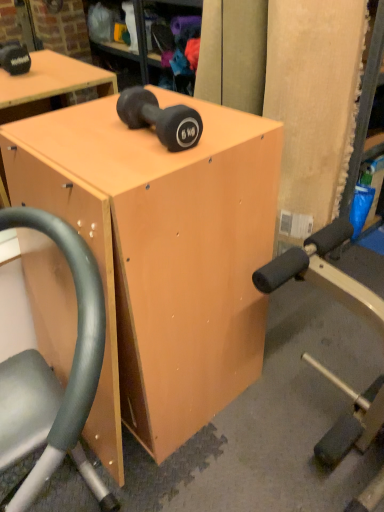
Where is `matte black dumbbell at center`? matte black dumbbell at center is located at coordinates (160, 118).

What do you see at coordinates (160, 118) in the screenshot?
I see `matte black dumbbell at center` at bounding box center [160, 118].

Where is `matte wood table at center`? The height and width of the screenshot is (512, 384). matte wood table at center is located at coordinates (161, 257).

Image resolution: width=384 pixels, height=512 pixels. What do you see at coordinates (161, 257) in the screenshot? I see `matte wood table at center` at bounding box center [161, 257].

Where is `matte black dumbbell at center`? matte black dumbbell at center is located at coordinates (160, 118).

Which is more to the right, matte black dumbbell at center or matte wood table at center?

Positioned to the right is matte black dumbbell at center.

Between matte black dumbbell at center and matte wood table at center, which one is positioned behind?

matte black dumbbell at center is further from the camera.

Does point (170, 108) come behind point (180, 194)?

That is True.

From the image's perspective, would you say matte black dumbbell at center is shown under matte wood table at center?

No.

From a real-world perspective, is matte black dumbbell at center located beneath matte wood table at center?

Incorrect, from a real-world perspective, matte black dumbbell at center is higher than matte wood table at center.

Does matte black dumbbell at center have a lesser width compared to matte wood table at center?

Yes.

Which of these two, matte black dumbbell at center or matte wood table at center, stands taller?

matte wood table at center is taller.

Who is bigger, matte black dumbbell at center or matte wood table at center?

matte wood table at center is bigger.

Choose the correct answer: Is matte black dumbbell at center inside matte wood table at center or outside it?

matte black dumbbell at center cannot be found inside matte wood table at center.

Are matte black dumbbell at center and matte wood table at center beside each other?

matte black dumbbell at center and matte wood table at center are not in contact.

Is matte black dumbbell at center oriented away from matte wood table at center?

That's not correct — matte black dumbbell at center is not looking away from matte wood table at center.

What's the angular difference between matte black dumbbell at center and matte wood table at center's facing directions?

The angle between the facing direction of matte black dumbbell at center and the facing direction of matte wood table at center is 1.64 degrees.

Find the location of a particular element. Image resolution: width=384 pixels, height=512 pixels. table that is below the matte black dumbbell at center (from the image's perspective) is located at coordinates (161, 257).

Considering the relative positions of matte wood table at center and matte black dumbbell at center in the image provided, is matte wood table at center to the right of matte black dumbbell at center from the viewer's perspective?

No.

Which is behind, matte wood table at center or matte black dumbbell at center?

matte black dumbbell at center.

Is point (33, 190) behind point (127, 96)?

No, (33, 190) is in front of (127, 96).

From the image's perspective, who appears lower, matte wood table at center or matte black dumbbell at center?

From the image's view, matte wood table at center is below.

From a real-world perspective, is matte wood table at center positioned over matte black dumbbell at center based on gravity?

No, from a real-world perspective, matte wood table at center is not above matte black dumbbell at center.

Between matte wood table at center and matte black dumbbell at center, which one has larger width?

matte wood table at center.

From their relative heights in the image, would you say matte wood table at center is taller or shorter than matte black dumbbell at center?

matte wood table at center is taller than matte black dumbbell at center.

Consider the image. Who is smaller, matte wood table at center or matte black dumbbell at center?

matte black dumbbell at center is smaller.

Is matte wood table at center not within matte black dumbbell at center?

Yes, matte wood table at center is not within matte black dumbbell at center.

Would you consider matte wood table at center to be distant from matte black dumbbell at center?

No, matte wood table at center is in close proximity to matte black dumbbell at center.

Is matte wood table at center oriented towards matte black dumbbell at center?

No, matte wood table at center does not turn towards matte black dumbbell at center.

Where is `table that is on the left side of matte black dumbbell at center`? The height and width of the screenshot is (512, 384). table that is on the left side of matte black dumbbell at center is located at coordinates (161, 257).

In order to click on dumbbell positioned vertically above the matte wood table at center (from a real-world perspective) in this screenshot , I will do `click(160, 118)`.

Where is `table in front of the matte black dumbbell at center`? table in front of the matte black dumbbell at center is located at coordinates (161, 257).